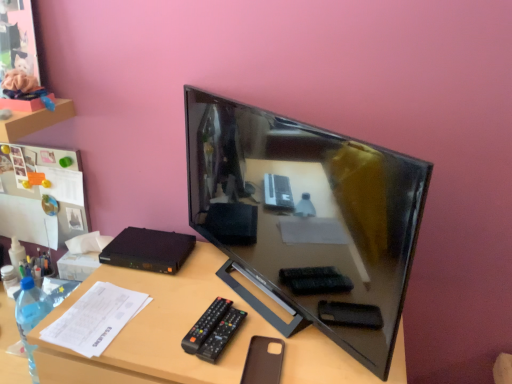
I want to click on free point below white paper at lower left (from a real-world perspective), so click(x=102, y=314).